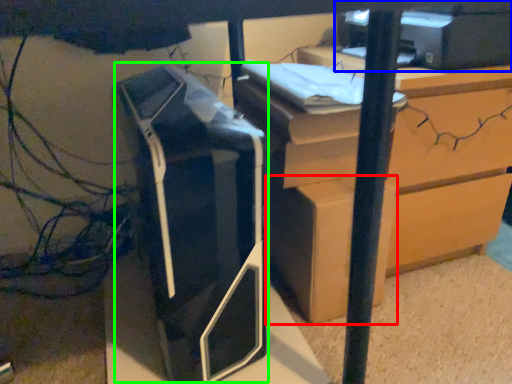
Question: Which object is the closest to the cardboard box (highlighted by a red box)? Choose among these: printer (highlighted by a blue box) or printer (highlighted by a green box).

Choices:
 (A) printer
 (B) printer

Answer: (B)